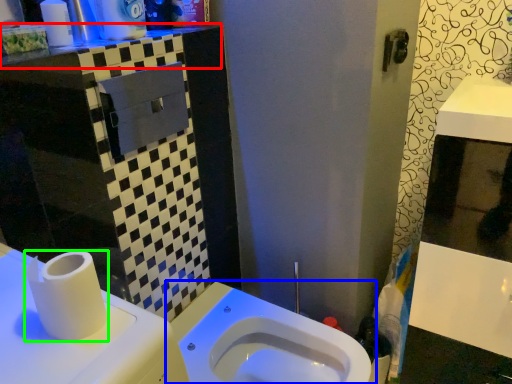
Question: Which object is positioned closest to counter top (highlighted by a red box)? Select from toilet (highlighted by a blue box) and toilet paper (highlighted by a green box).

Choices:
 (A) toilet
 (B) toilet paper

Answer: (B)